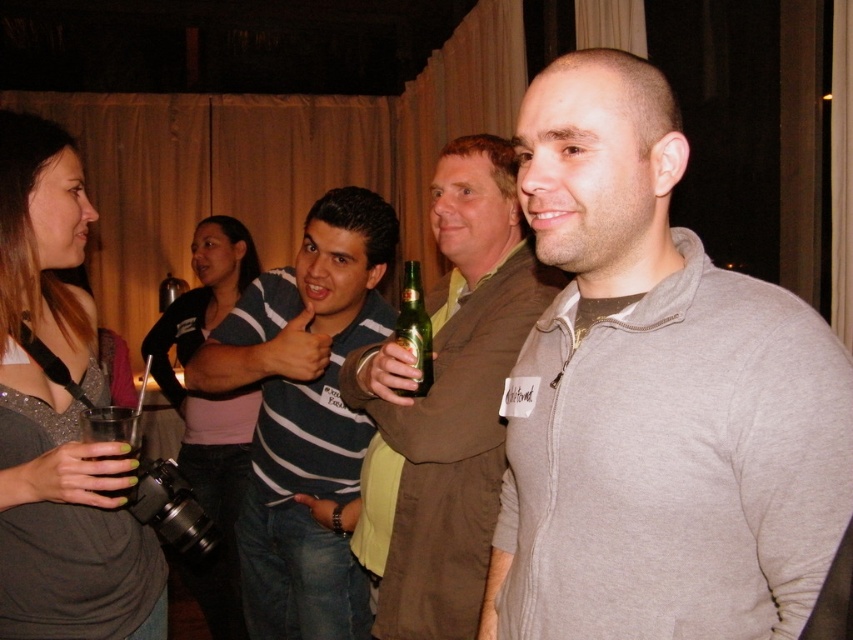
Between gray zip-up sweater at center and matte brown coat at center, which one is positioned higher?

gray zip-up sweater at center is higher up.

Is gray zip-up sweater at center bigger than matte brown coat at center?

Incorrect, gray zip-up sweater at center is not larger than matte brown coat at center.

Locate an element on the screen. The width and height of the screenshot is (853, 640). gray zip-up sweater at center is located at coordinates (654, 397).

Between striped cotton shirt at center and clear plastic cup at lower left, which one is positioned lower?

striped cotton shirt at center is below.

Who is positioned more to the left, striped cotton shirt at center or clear plastic cup at lower left?

clear plastic cup at lower left

The image size is (853, 640). What do you see at coordinates (305, 416) in the screenshot?
I see `striped cotton shirt at center` at bounding box center [305, 416].

This screenshot has height=640, width=853. I want to click on striped cotton shirt at center, so click(x=305, y=416).

The width and height of the screenshot is (853, 640). Describe the element at coordinates (56, 417) in the screenshot. I see `matte gray dress at left` at that location.

Who is more forward, (131, 604) or (265, 413)?

Point (131, 604) is in front.

Identify the location of matte gray dress at left. (56, 417).